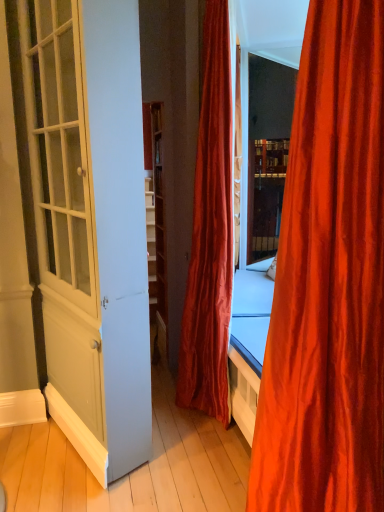
Question: Looking at the image, does white glossy door at left seem bigger or smaller compared to velvet red curtain at center, which is the 1th curtain from back to front?

Choices:
 (A) small
 (B) big

Answer: (B)

Question: In terms of width, does white glossy door at left look wider or thinner when compared to velvet red curtain at center, which is the 1th curtain from back to front?

Choices:
 (A) wide
 (B) thin

Answer: (B)

Question: Which is farther from the silky orange curtain at right, arranged as the second curtain when viewed from the back?

Choices:
 (A) white glossy door at left
 (B) velvet red curtain at center, which is the 1th curtain from back to front

Answer: (B)

Question: Estimate the real-world distances between objects in this image. Which object is closer to the silky orange curtain at right, the first curtain in the front-to-back sequence?

Choices:
 (A) velvet red curtain at center, which appears as the second curtain when viewed from the front
 (B) white glossy door at left

Answer: (B)